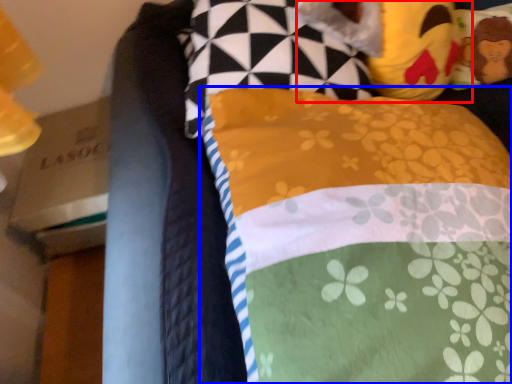
Question: Which object appears closest to the camera in this image, figurine (highlighted by a red box) or pillow (highlighted by a blue box)?

Choices:
 (A) figurine
 (B) pillow

Answer: (B)